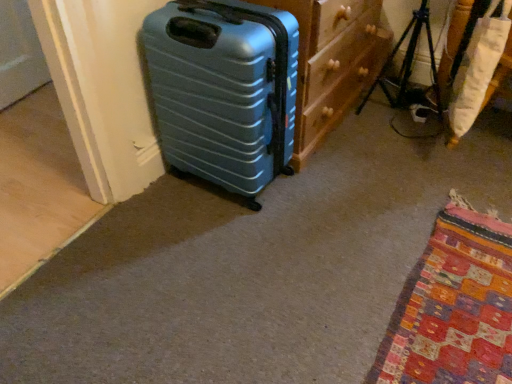
Question: Can you confirm if wooden dresser at center is wider than teal plastic suitcase at left?

Choices:
 (A) no
 (B) yes

Answer: (A)

Question: Is wooden dresser at center positioned behind teal plastic suitcase at left?

Choices:
 (A) yes
 (B) no

Answer: (A)

Question: Is wooden dresser at center closer to the viewer compared to teal plastic suitcase at left?

Choices:
 (A) yes
 (B) no

Answer: (B)

Question: Is wooden dresser at center far from teal plastic suitcase at left?

Choices:
 (A) yes
 (B) no

Answer: (B)

Question: Does wooden dresser at center appear on the left side of teal plastic suitcase at left?

Choices:
 (A) yes
 (B) no

Answer: (B)

Question: From a real-world perspective, does wooden dresser at center stand above teal plastic suitcase at left?

Choices:
 (A) no
 (B) yes

Answer: (B)

Question: Does teal plastic suitcase at left have a greater width compared to metallic tripod at center right?

Choices:
 (A) yes
 (B) no

Answer: (A)

Question: Does teal plastic suitcase at left come in front of metallic tripod at center right?

Choices:
 (A) yes
 (B) no

Answer: (A)

Question: Considering the relative sizes of teal plastic suitcase at left and metallic tripod at center right in the image provided, is teal plastic suitcase at left smaller than metallic tripod at center right?

Choices:
 (A) yes
 (B) no

Answer: (B)

Question: From a real-world perspective, is teal plastic suitcase at left located higher than metallic tripod at center right?

Choices:
 (A) no
 (B) yes

Answer: (B)

Question: Is teal plastic suitcase at left facing away from metallic tripod at center right?

Choices:
 (A) yes
 (B) no

Answer: (B)

Question: Does teal plastic suitcase at left lie behind metallic tripod at center right?

Choices:
 (A) no
 (B) yes

Answer: (A)

Question: Can you confirm if metallic tripod at center right is wider than wooden dresser at center?

Choices:
 (A) no
 (B) yes

Answer: (A)